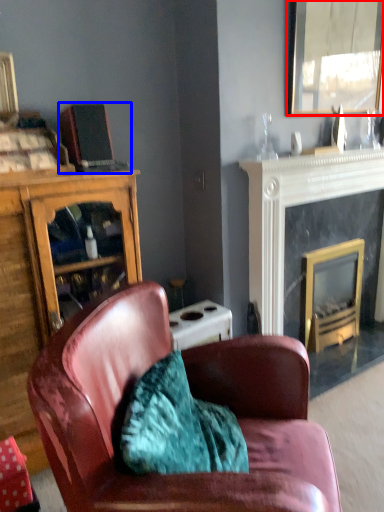
Question: Among these objects, which one is farthest to the camera, mirror (highlighted by a red box) or laptop (highlighted by a blue box)?

Choices:
 (A) mirror
 (B) laptop

Answer: (A)